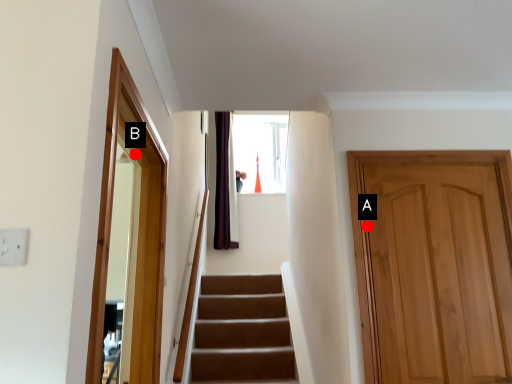
Question: Two points are circled on the image, labeled by A and B beside each circle. Which point appears farthest from the camera in this image?

Choices:
 (A) A is further
 (B) B is further

Answer: (A)